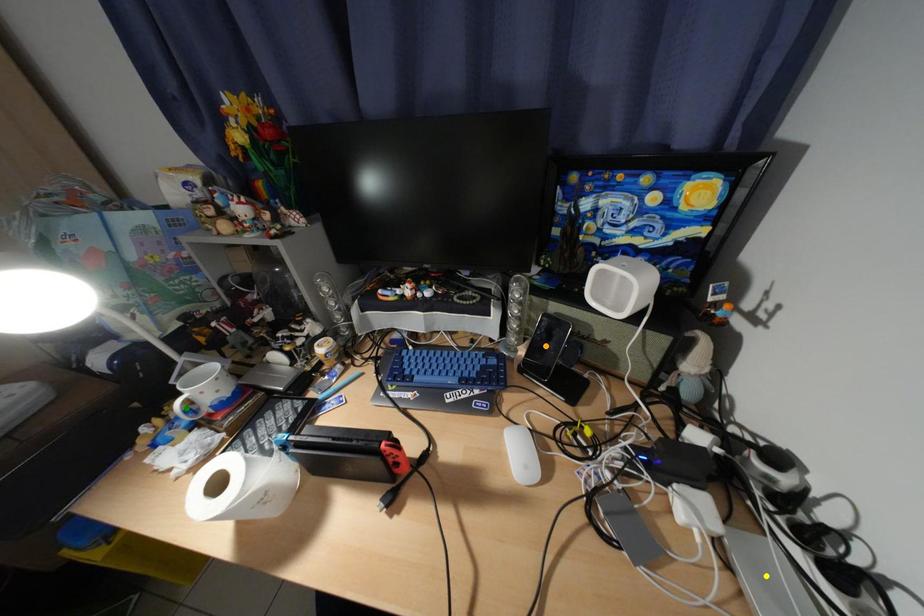
Order these from nearest to farthest:
yellow point
orange point
green point

yellow point < green point < orange point